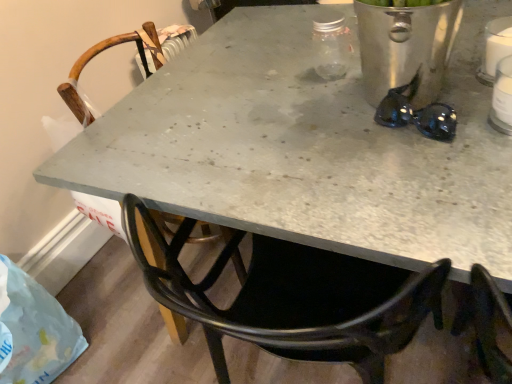
Question: From the image's perspective, is white plastic bottle at upper right under translucent plastic bag at lower left?

Choices:
 (A) no
 (B) yes

Answer: (A)

Question: Does white plastic bottle at upper right have a lesser width compared to translucent plastic bag at lower left?

Choices:
 (A) yes
 (B) no

Answer: (A)

Question: From a real-world perspective, is white plastic bottle at upper right positioned over translucent plastic bag at lower left based on gravity?

Choices:
 (A) no
 (B) yes

Answer: (B)

Question: Is white plastic bottle at upper right taller than translucent plastic bag at lower left?

Choices:
 (A) no
 (B) yes

Answer: (A)

Question: Can you confirm if white plastic bottle at upper right is smaller than translucent plastic bag at lower left?

Choices:
 (A) no
 (B) yes

Answer: (B)

Question: Does white plastic bottle at upper right appear on the left side of translucent plastic bag at lower left?

Choices:
 (A) no
 (B) yes

Answer: (A)

Question: From the image's perspective, does translucent plastic bag at lower left appear lower than wooden chair at center?

Choices:
 (A) yes
 (B) no

Answer: (A)

Question: Considering the relative sizes of translucent plastic bag at lower left and wooden chair at center in the image provided, is translucent plastic bag at lower left bigger than wooden chair at center?

Choices:
 (A) no
 (B) yes

Answer: (A)

Question: From a real-world perspective, is translucent plastic bag at lower left beneath wooden chair at center?

Choices:
 (A) yes
 (B) no

Answer: (A)

Question: Does translucent plastic bag at lower left turn towards wooden chair at center?

Choices:
 (A) yes
 (B) no

Answer: (B)

Question: Is translucent plastic bag at lower left at the left side of wooden chair at center?

Choices:
 (A) yes
 (B) no

Answer: (A)

Question: Is translucent plastic bag at lower left shorter than wooden chair at center?

Choices:
 (A) yes
 (B) no

Answer: (A)

Question: Can you confirm if black shiny sunglasses at upper right is shorter than wooden chair at center?

Choices:
 (A) yes
 (B) no

Answer: (A)